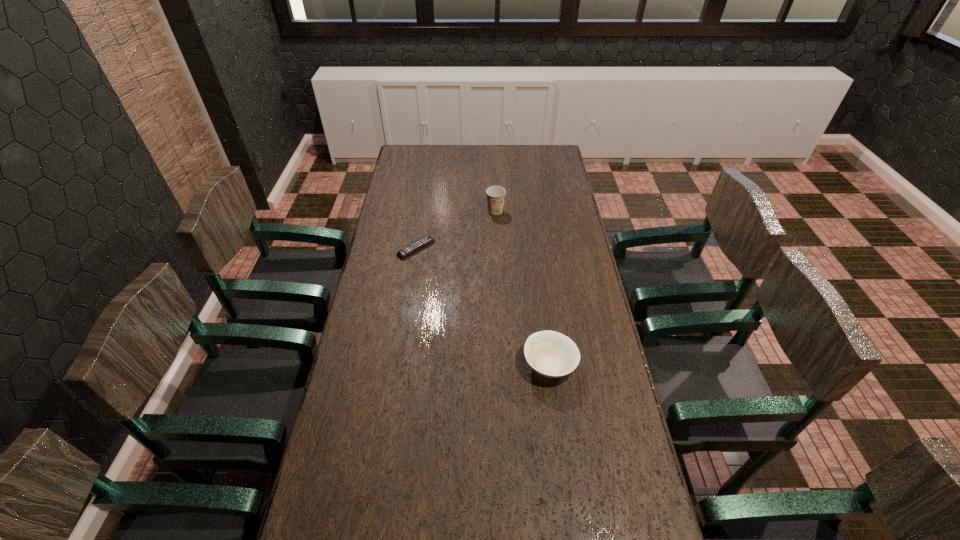
The height and width of the screenshot is (540, 960). What are the coordinates of `object at the right edge` in the screenshot? It's located at (551, 354).

Where is `free spot at the far edge of the desktop`? free spot at the far edge of the desktop is located at coordinates (475, 146).

Find the location of `free space at the left edge`. free space at the left edge is located at coordinates (425, 178).

In the image, there is a desktop. Where is `free space at the right edge`? free space at the right edge is located at coordinates (633, 442).

The height and width of the screenshot is (540, 960). I want to click on free space at the far right corner of the desktop, so click(533, 158).

You are a GUI agent. You are given a task and a screenshot of the screen. Output one action in this format:
    pyautogui.click(x=<x>, y=<y>)
    Task: Click on the blank region between the bowl and the farthest object
    
    Given the screenshot: What is the action you would take?
    pyautogui.click(x=522, y=288)

Find the location of a particular element. free space that is in between the second nearest object and the second tallest object is located at coordinates (483, 307).

This screenshot has height=540, width=960. I want to click on vacant area that lies between the second object from left to right and the bowl, so click(522, 288).

At what (x,y) coordinates should I click in order to perform the action: click on vacant area that lies between the tallest object and the shortest object. Please return your answer as a coordinate pair (x, y). Looking at the image, I should click on (456, 230).

Identify the location of free space between the shortest object and the tallest object. Image resolution: width=960 pixels, height=540 pixels. (456, 230).